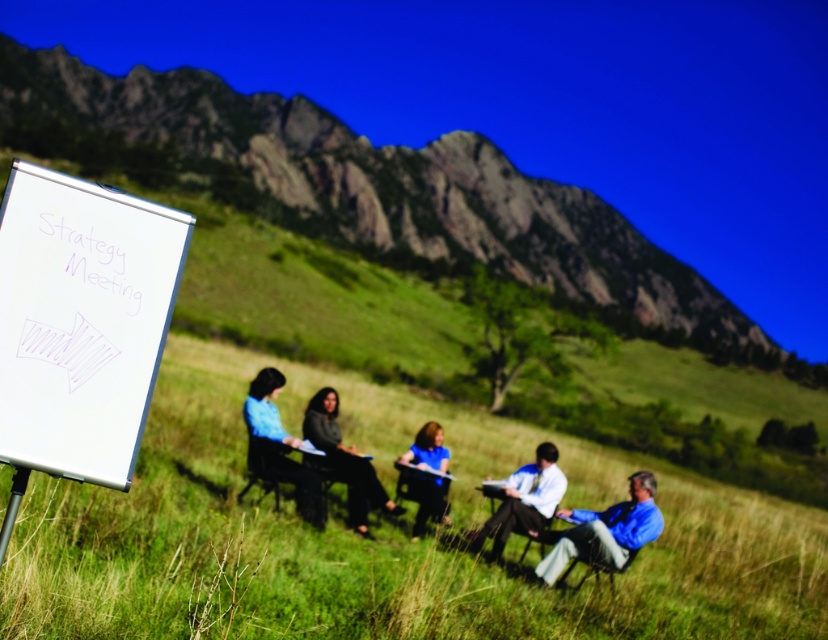
Question: Is green grass at center to the right of light blue shirt at center from the viewer's perspective?

Choices:
 (A) yes
 (B) no

Answer: (A)

Question: Which point is closer to the camera taking this photo?

Choices:
 (A) (538, 515)
 (B) (725, 531)

Answer: (A)

Question: Is metallic folding chair at center positioned at the back of matte black chair at center?

Choices:
 (A) yes
 (B) no

Answer: (B)

Question: Which object appears closest to the camera in this image?

Choices:
 (A) blue shirt at center
 (B) blue fabric shirt at center
 (C) white matte flipchart at left
 (D) matte black chair at center

Answer: (C)

Question: Is the position of green grass at center more distant than that of metallic silver chair at lower right?

Choices:
 (A) yes
 (B) no

Answer: (B)

Question: Which of the following is the closest to the observer?

Choices:
 (A) light blue shirt at center
 (B) blue shirt at center
 (C) blue fabric shirt at center
 (D) matte black chair at center

Answer: (A)